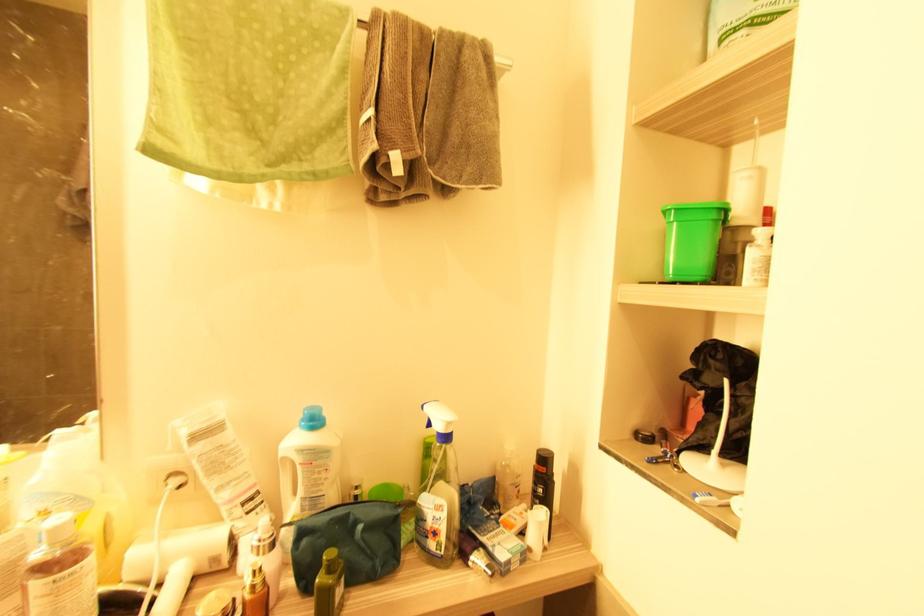
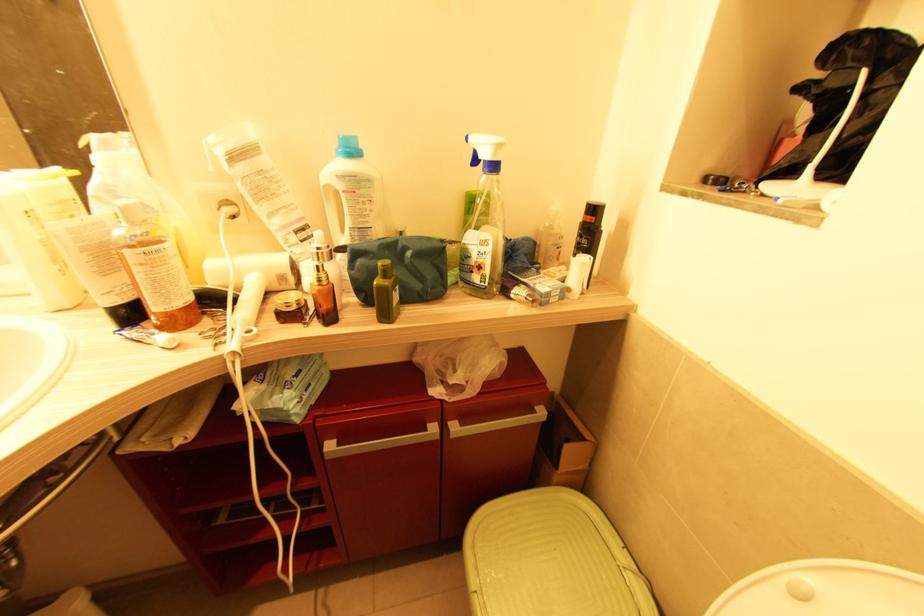
Where in the second image is the point corresponding to the point at 216,561 from the first image?

(284, 278)